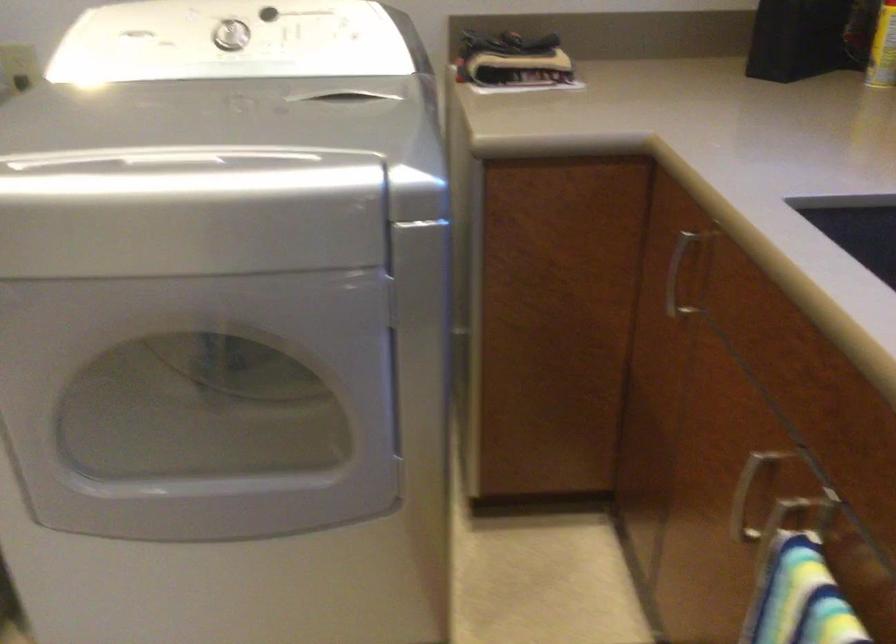
This screenshot has height=644, width=896. Describe the element at coordinates (229, 35) in the screenshot. I see `a white control dial` at that location.